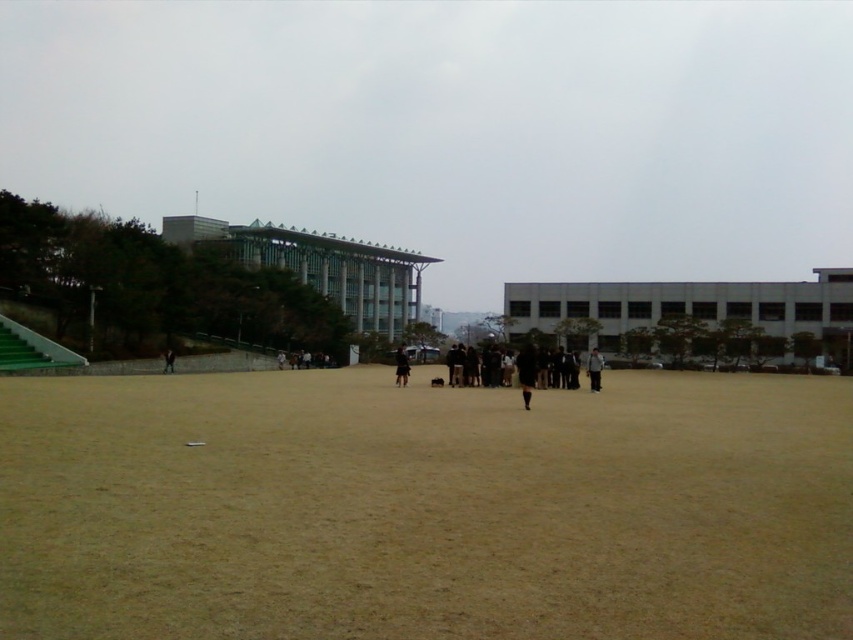
You are standing in the middle of an open area and see two jackets lying on the ground. The dark brown leather jacket at center and the black matte jacket at center. Which jacket is positioned to the right?

The dark brown leather jacket at center is positioned to the right of the black matte jacket at center.

You are a photographer setting up a shoot in the open area. You have a dark brown leather jacket at center and a matte black person at center in your frame. To ensure the jacket doesn not overwhelm the person, which object should you move closer to the camera?

The dark brown leather jacket at center is wider than the matte black person at center. To prevent the jacket from overwhelming the person, you should move the matte black person at center closer to the camera so that its apparent size increases, balancing the visual weight between the two objects.